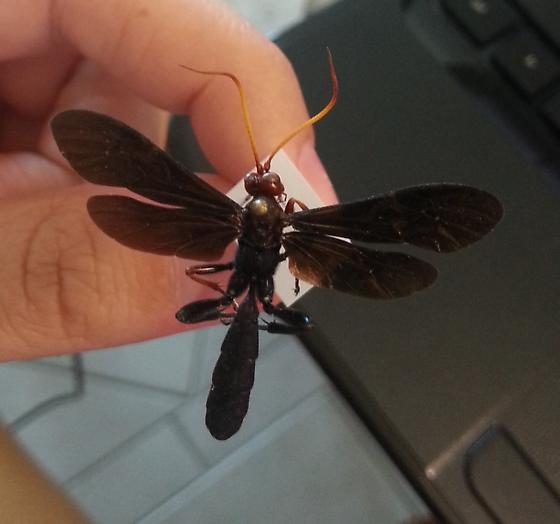
Where is `laptop`? This screenshot has width=560, height=524. laptop is located at coordinates (496, 325).